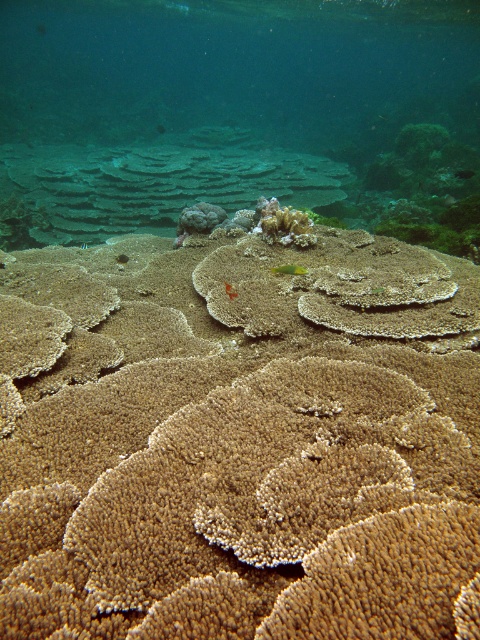
You are a scuba diver observing the underwater scene. You notice a brown textured coral reef at center and a translucent orange fish at center. From your perspective, which object is positioned to the right of the other?

The brown textured coral reef at center is to the right of the translucent orange fish at center.

You are a marine biologist observing the underwater scene. You notice two corals labeled as brown textured coral reef at center and brown coral at center. Which one is positioned lower in the image?

The brown textured coral reef at center is located below the brown coral at center, so it is positioned lower in the image.

You are a diver exploring the underwater coral reef. You notice two points marked in the image. Which point, point [440,547] or point [225,289], is closer to you?

Point [440,547] is in front of point [225,289], so it is closer to you.